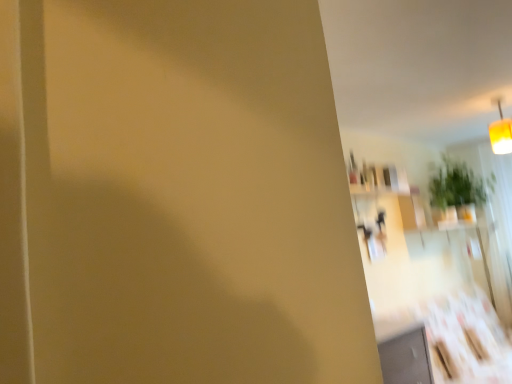
The image size is (512, 384). Describe the element at coordinates (501, 134) in the screenshot. I see `yellow fabric lampshade at upper right` at that location.

You are a GUI agent. You are given a task and a screenshot of the screen. Output one action in this format:
    pyautogui.click(x=<x>, y=<y>)
    Task: Click on the yellow fabric lampshade at upper right
    
    Given the screenshot: What is the action you would take?
    pyautogui.click(x=501, y=134)

Identify the location of green leafy plant at upper right. The width and height of the screenshot is (512, 384). (457, 185).

Describe the element at coordinates (457, 185) in the screenshot. I see `green leafy plant at upper right` at that location.

Measure the distance between point (460, 200) and camera.

Point (460, 200) is 14.40 feet from camera.

What is the approximate width of green leafy plant at upper right?

green leafy plant at upper right is 18.45 inches wide.

I want to click on yellow fabric lampshade at upper right, so click(x=501, y=134).

Between yellow fabric lampshade at upper right and green leafy plant at upper right, which one appears on the right side from the viewer's perspective?

From the viewer's perspective, green leafy plant at upper right appears more on the right side.

Is the depth of yellow fabric lampshade at upper right greater than that of green leafy plant at upper right?

No, it is not.

Which point is more distant from viewer, (496, 139) or (487, 194)?

The point (487, 194) is farther.

From the image's perspective, relative to green leafy plant at upper right, is yellow fabric lampshade at upper right above or below?

Based on their image positions, yellow fabric lampshade at upper right is located above green leafy plant at upper right.

From a real-world perspective, is yellow fabric lampshade at upper right under green leafy plant at upper right?

Incorrect, from a real-world perspective, yellow fabric lampshade at upper right is higher than green leafy plant at upper right.

Which object is thinner, yellow fabric lampshade at upper right or green leafy plant at upper right?

With smaller width is yellow fabric lampshade at upper right.

Between yellow fabric lampshade at upper right and green leafy plant at upper right, which one has less height?

yellow fabric lampshade at upper right is shorter.

Based on their sizes in the image, would you say yellow fabric lampshade at upper right is bigger or smaller than green leafy plant at upper right?

Clearly, yellow fabric lampshade at upper right is smaller in size than green leafy plant at upper right.

Is yellow fabric lampshade at upper right inside the boundaries of green leafy plant at upper right, or outside?

yellow fabric lampshade at upper right is spatially situated outside green leafy plant at upper right.

From the picture: Is yellow fabric lampshade at upper right in contact with green leafy plant at upper right?

No, yellow fabric lampshade at upper right is not beside green leafy plant at upper right.

Could you tell me if yellow fabric lampshade at upper right is turned towards green leafy plant at upper right?

No, yellow fabric lampshade at upper right does not turn towards green leafy plant at upper right.

Based on the photo, how different are the orientations of yellow fabric lampshade at upper right and green leafy plant at upper right in degrees?

The facing directions of yellow fabric lampshade at upper right and green leafy plant at upper right are 98.1 degrees apart.

How much distance is there between yellow fabric lampshade at upper right and green leafy plant at upper right?

yellow fabric lampshade at upper right is 32.46 inches away from green leafy plant at upper right.

This screenshot has height=384, width=512. In order to click on light fixture above the green leafy plant at upper right (from the image's perspective) in this screenshot , I will do `click(501, 134)`.

In the image, is green leafy plant at upper right on the left side or the right side of yellow fabric lampshade at upper right?

From the image, it's evident that green leafy plant at upper right is to the right of yellow fabric lampshade at upper right.

Is green leafy plant at upper right in front of or behind yellow fabric lampshade at upper right in the image?

Clearly, green leafy plant at upper right is behind yellow fabric lampshade at upper right.

Considering the positions of point (480, 180) and point (510, 120), is point (480, 180) closer or farther from the camera than point (510, 120)?

Point (480, 180) is farther from the camera than point (510, 120).

From the image's perspective, relative to yellow fabric lampshade at upper right, is green leafy plant at upper right above or below?

green leafy plant at upper right is situated lower than yellow fabric lampshade at upper right in the image.

From a real-world perspective, does green leafy plant at upper right stand above yellow fabric lampshade at upper right?

Incorrect, from a real-world perspective, green leafy plant at upper right is lower than yellow fabric lampshade at upper right.

Which object is wider, green leafy plant at upper right or yellow fabric lampshade at upper right?

green leafy plant at upper right is wider.

Who is shorter, green leafy plant at upper right or yellow fabric lampshade at upper right?

With less height is yellow fabric lampshade at upper right.

From the picture: Between green leafy plant at upper right and yellow fabric lampshade at upper right, which one has smaller size?

With smaller size is yellow fabric lampshade at upper right.

Can we say green leafy plant at upper right lies outside yellow fabric lampshade at upper right?

Yes, green leafy plant at upper right is outside of yellow fabric lampshade at upper right.

Is green leafy plant at upper right touching yellow fabric lampshade at upper right?

There is a gap between green leafy plant at upper right and yellow fabric lampshade at upper right.

Could you tell me if green leafy plant at upper right is facing yellow fabric lampshade at upper right?

No, green leafy plant at upper right is not oriented towards yellow fabric lampshade at upper right.

How many degrees apart are the facing directions of green leafy plant at upper right and yellow fabric lampshade at upper right?

The angle between the facing direction of green leafy plant at upper right and the facing direction of yellow fabric lampshade at upper right is 98.1 degrees.

Find the location of a particular element. This screenshot has height=384, width=512. light fixture in front of the green leafy plant at upper right is located at coordinates (501, 134).

Where is `light fixture in front of the green leafy plant at upper right`? This screenshot has height=384, width=512. light fixture in front of the green leafy plant at upper right is located at coordinates (501, 134).

I want to click on plant on the right of the yellow fabric lampshade at upper right, so click(457, 185).